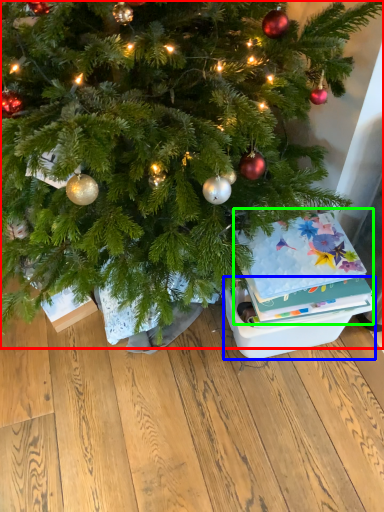
Question: Which object is the closest to the christmas tree (highlighted by a red box)? Choose among these: storage box (highlighted by a blue box) or christmas card (highlighted by a green box).

Choices:
 (A) storage box
 (B) christmas card

Answer: (B)